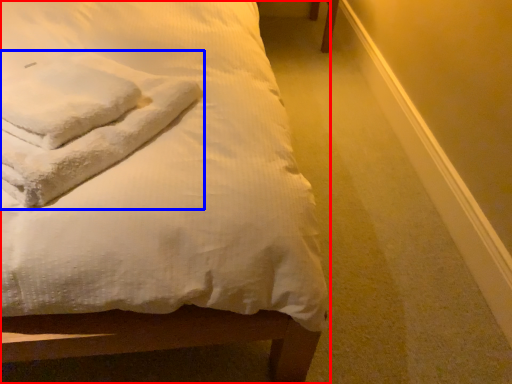
Question: Which object appears closest to the camera in this image, bed (highlighted by a red box) or cloth (highlighted by a blue box)?

Choices:
 (A) bed
 (B) cloth

Answer: (A)